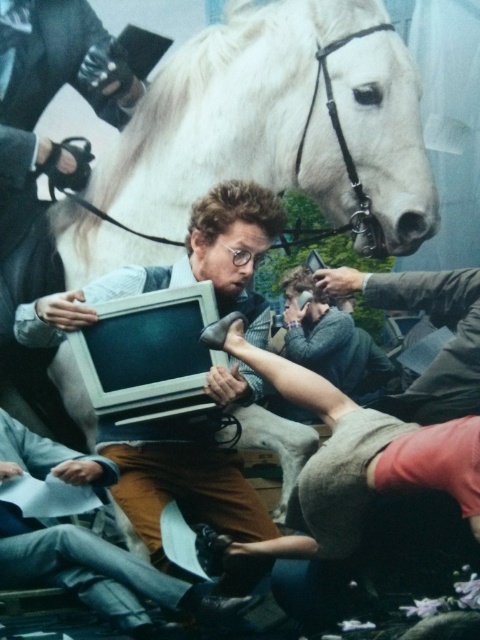
What do you see at coordinates (180, 266) in the screenshot? I see `matte plastic monitor at center` at bounding box center [180, 266].

Can you confirm if matte plastic monitor at center is wider than matte black monitor at center?

Yes.

At what (x,y) coordinates should I click in order to perform the action: click on matte plastic monitor at center. Please return your answer as a coordinate pair (x, y). The image size is (480, 640). Looking at the image, I should click on (180, 266).

The width and height of the screenshot is (480, 640). Find the location of `matte plastic monitor at center`. matte plastic monitor at center is located at coordinates (180, 266).

Does point (106, 410) lie behind point (348, 272)?

No.

Between matte gray monitor at center and smooth gray shirt at center, which one is positioned lower?

Positioned lower is matte gray monitor at center.

The image size is (480, 640). I want to click on matte gray monitor at center, so click(x=148, y=355).

Can you confirm if matte black monitor at center is wider than smooth gray shirt at center?

No, matte black monitor at center is not wider than smooth gray shirt at center.

Who is more distant from viewer, (37, 60) or (467, 413)?

The point (37, 60) is more distant.

The width and height of the screenshot is (480, 640). What are the coordinates of `matte black monitor at center` in the screenshot? It's located at (45, 108).